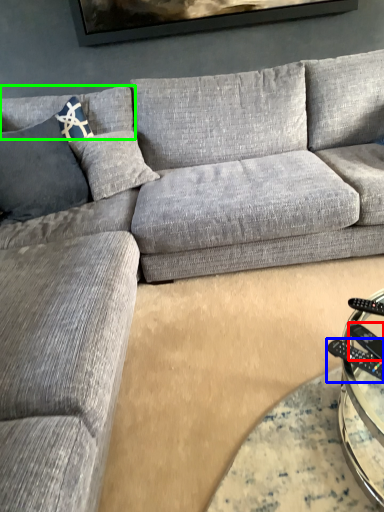
Question: Estimate the real-world distances between objects in this image. Which object is closer to remote (highlighted by a red box), control (highlighted by a blue box) or pillow (highlighted by a green box)?

Choices:
 (A) control
 (B) pillow

Answer: (A)